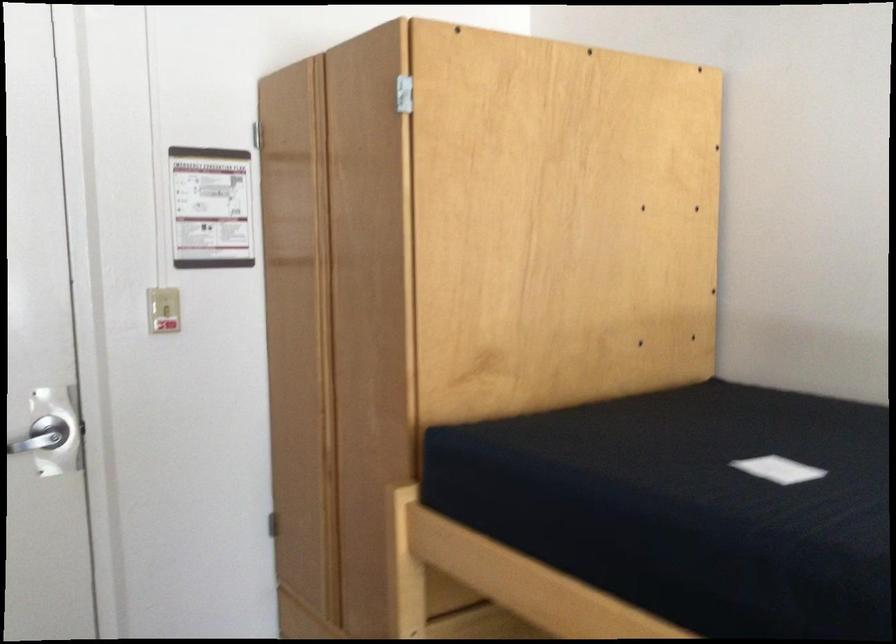
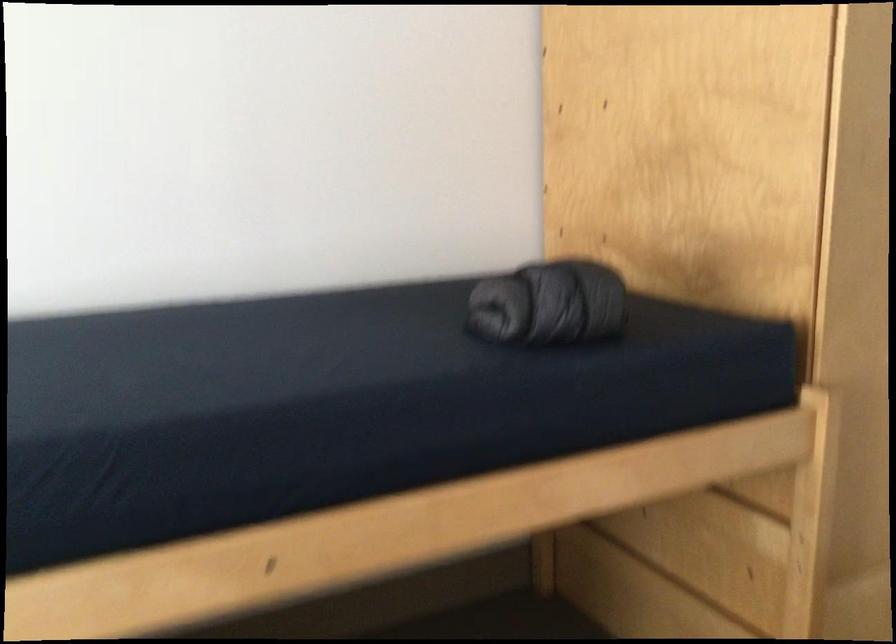
How did the camera likely rotate?

The rotation direction of the camera is left-down.